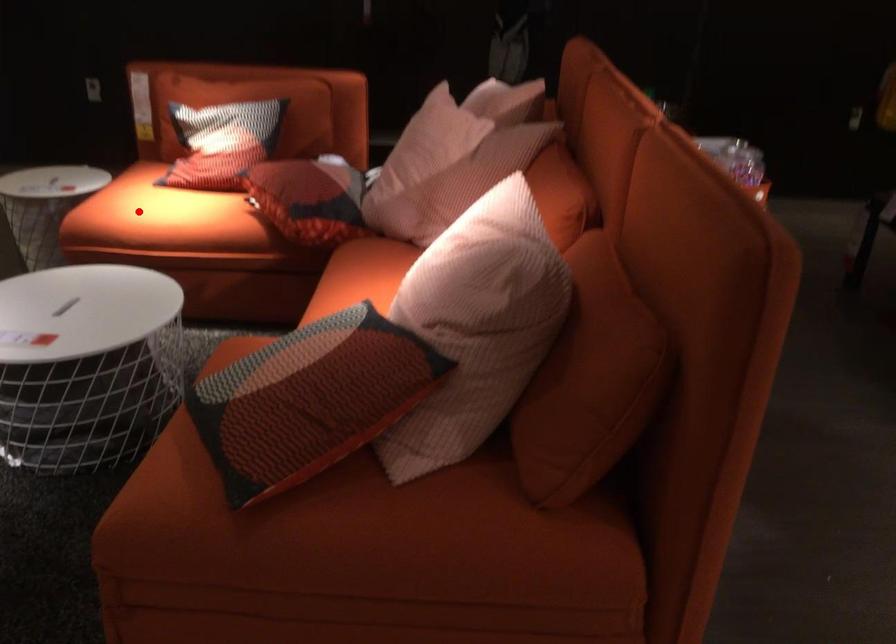
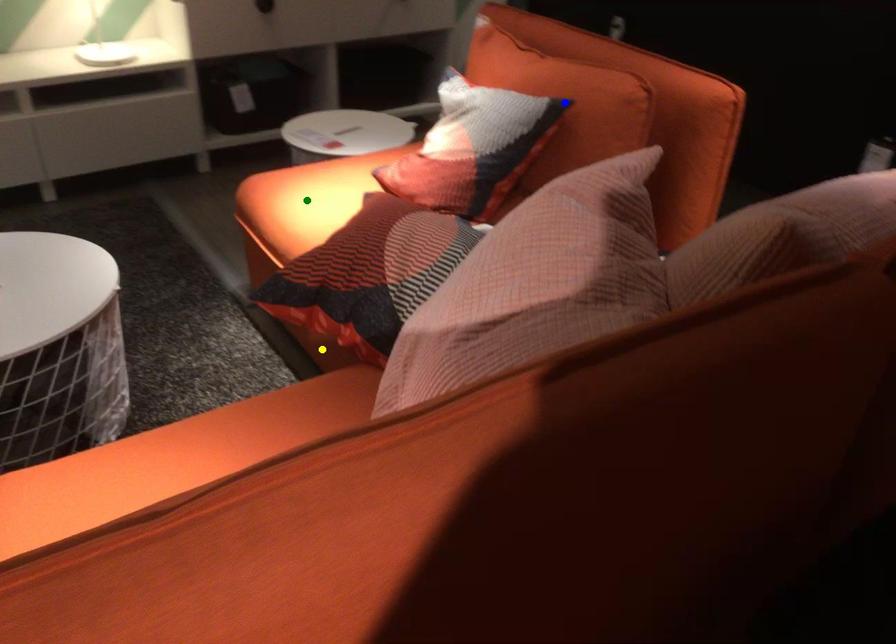
Question: I am providing you with two images of the same scene from different viewpoints. A red point is marked on the first image. You are given multiple points on the second image. In image 2, which mark is for the same physical point as the one in image 1?

Choices:
 (A) blue point
 (B) green point
 (C) yellow point

Answer: (B)